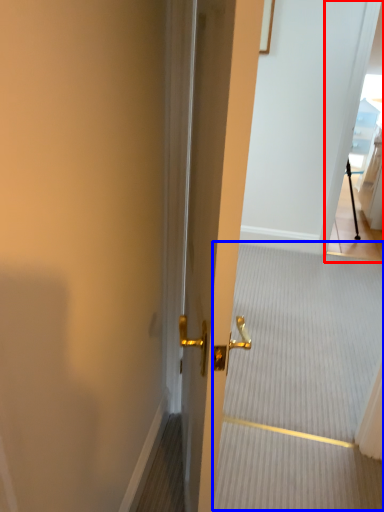
Question: Among these objects, which one is nearest to the camera, glass door (highlighted by a red box) or stair (highlighted by a blue box)?

Choices:
 (A) glass door
 (B) stair

Answer: (B)